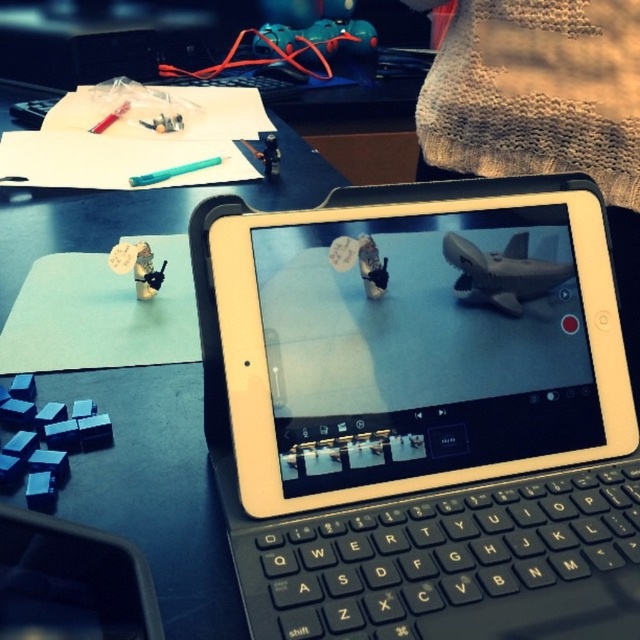
You are a robot trying to navigate from the point at coordinates point (20, 413) to the point at coordinates point (275, 168). According to the scene description, which direction should you move to reach your destination?

Since point (20, 413) is in front of point 0.264, 0431, you should move backward to reach the destination.

You are holding a camera and want to take a photo of the point at coordinates (x=22, y=419). The camera is currently 17.63 inches away from the point. If the camera requires a minimum distance of 15 inches to focus properly, will it be able to focus on the point?

The camera is 17.63 inches away from the point, which is greater than the minimum required distance of 15 inches. Therefore, the camera should be able to focus on the point.